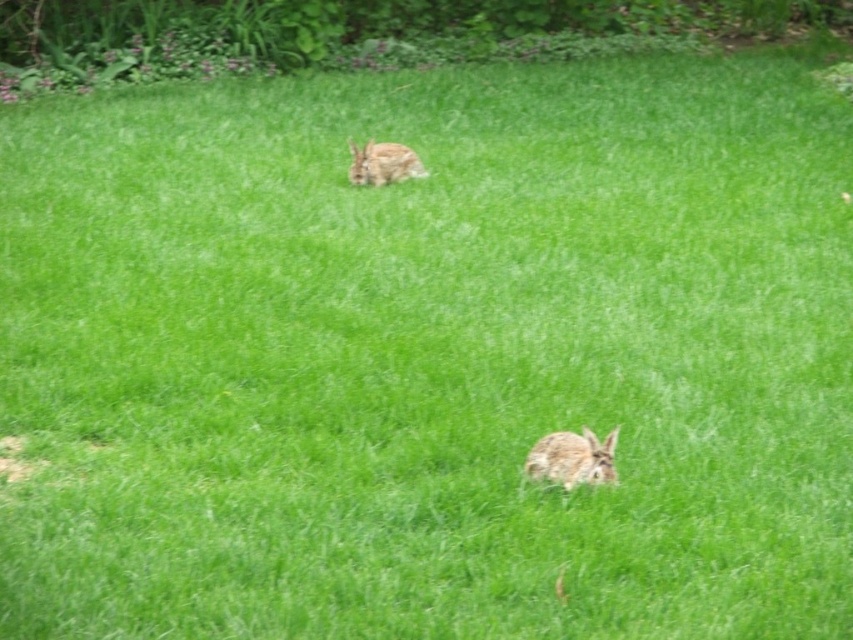
Question: Can you confirm if fuzzy brown rabbit at lower center is smaller than fuzzy brown rabbit at upper center?

Choices:
 (A) yes
 (B) no

Answer: (A)

Question: Does fuzzy brown rabbit at lower center come behind fuzzy brown rabbit at upper center?

Choices:
 (A) yes
 (B) no

Answer: (B)

Question: Among these points, which one is farthest from the camera?

Choices:
 (A) tap(370, 168)
 (B) tap(587, 444)

Answer: (A)

Question: Which object is farther from the camera taking this photo?

Choices:
 (A) fuzzy brown rabbit at lower center
 (B) fuzzy brown rabbit at upper center

Answer: (B)

Question: Can you confirm if fuzzy brown rabbit at lower center is bigger than fuzzy brown rabbit at upper center?

Choices:
 (A) no
 (B) yes

Answer: (A)

Question: Which object is closer to the camera taking this photo?

Choices:
 (A) fuzzy brown rabbit at lower center
 (B) fuzzy brown rabbit at upper center

Answer: (A)